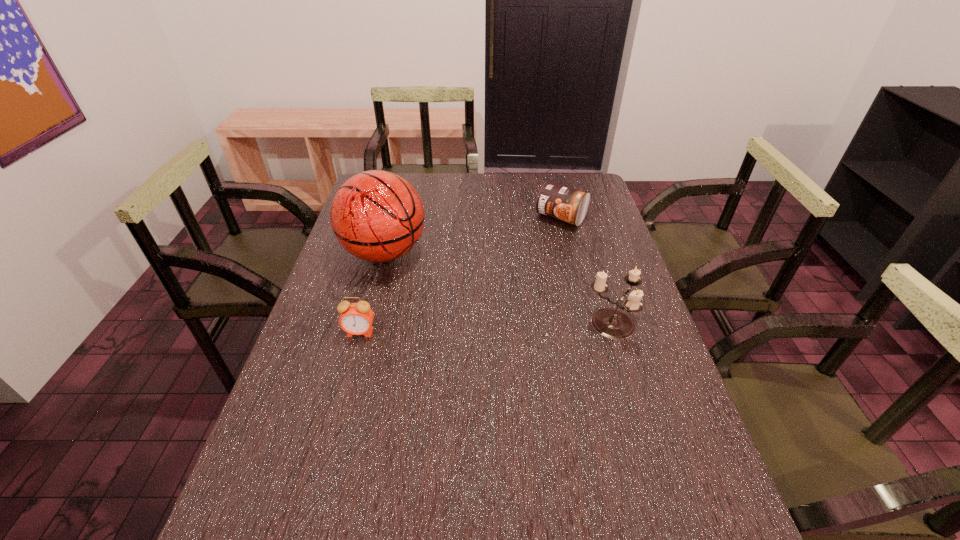
Where is `vacant space at the right edge of the desktop`? The width and height of the screenshot is (960, 540). vacant space at the right edge of the desktop is located at coordinates coord(654,397).

Where is `free space at the far left corner`? This screenshot has width=960, height=540. free space at the far left corner is located at coordinates (404, 178).

The image size is (960, 540). In the image, there is a desktop. Identify the location of vacant space at the far right corner. (575, 186).

In the image, there is a desktop. Identify the location of vacant space at the near right corner. Image resolution: width=960 pixels, height=540 pixels. (631, 466).

Locate an element on the screen. The image size is (960, 540). free spot between the alarm clock and the third shortest object is located at coordinates (485, 329).

I want to click on empty space between the basketball and the alarm clock, so click(x=372, y=293).

Identify the location of free space between the second tallest object and the basketball. (497, 289).

Locate an element on the screen. Image resolution: width=960 pixels, height=540 pixels. free space between the can and the basketball is located at coordinates (473, 235).

Locate an element on the screen. vacant space that is in between the basketball and the third shortest object is located at coordinates (497, 289).

Where is `vacant space in between the can and the alarm clock`? This screenshot has width=960, height=540. vacant space in between the can and the alarm clock is located at coordinates (461, 275).